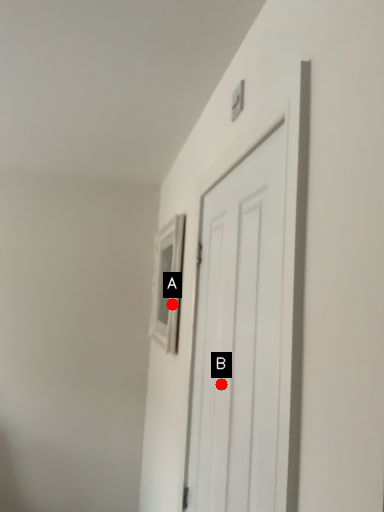
Question: Two points are circled on the image, labeled by A and B beside each circle. Which point is further to the camera?

Choices:
 (A) A is further
 (B) B is further

Answer: (A)